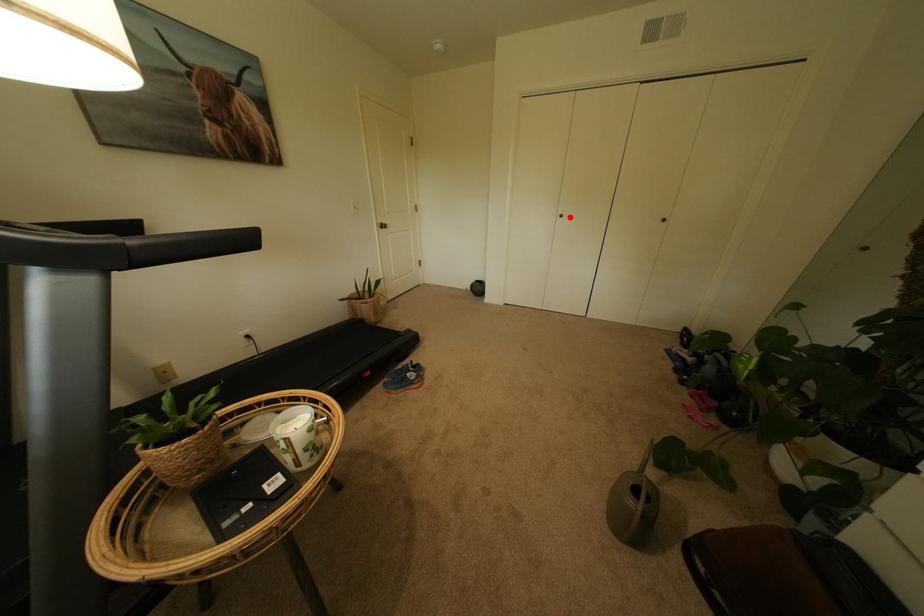
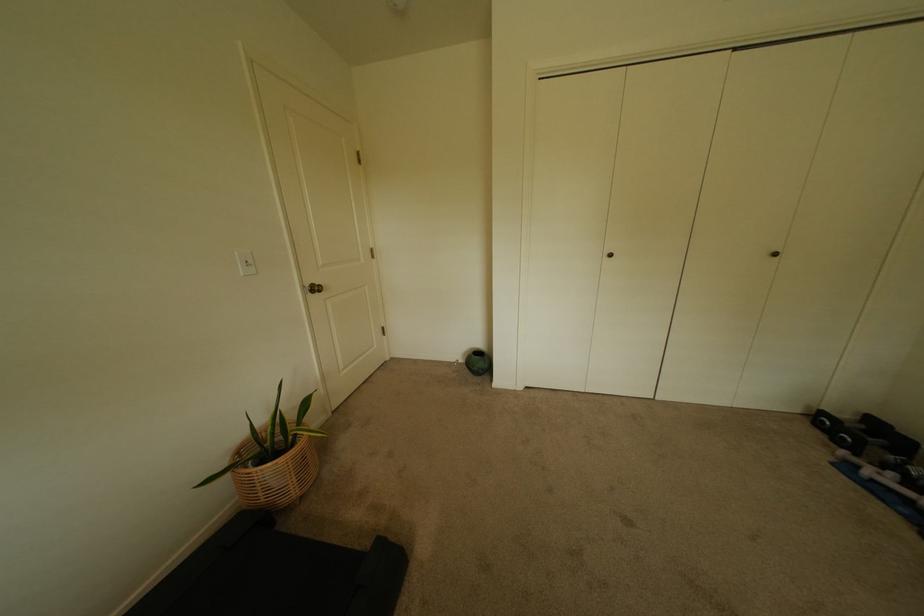
Where in the second image is the point corresponding to the highlighted location from the first image?

(618, 256)